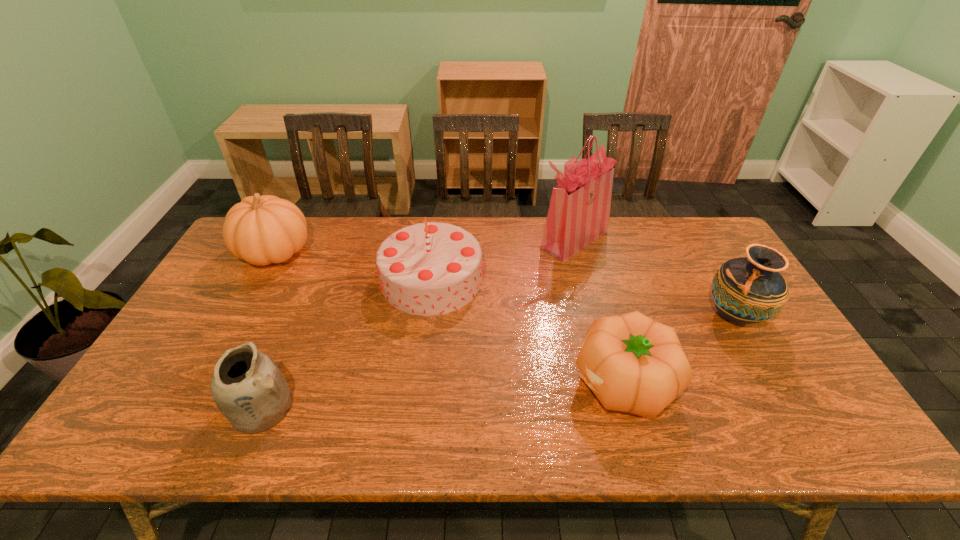
Locate an element on the screen. vacant space that satisfies the following two spatial constraints: 1. on the front side of the right pottery; 2. on the right side of the birthday cake is located at coordinates (427, 315).

Image resolution: width=960 pixels, height=540 pixels. Find the location of `free location that satisfies the following two spatial constraints: 1. on the back side of the shopping bag; 2. on the left side of the farther pumpkin`. free location that satisfies the following two spatial constraints: 1. on the back side of the shopping bag; 2. on the left side of the farther pumpkin is located at coordinates pyautogui.click(x=282, y=239).